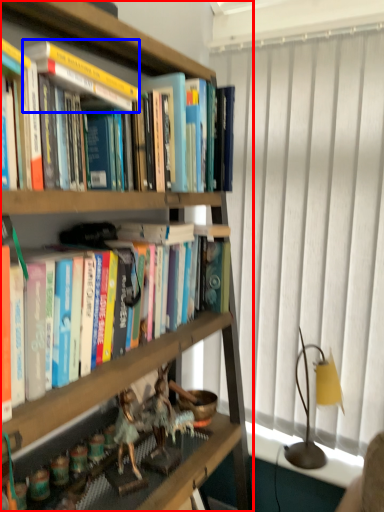
Question: Which point is closer to the camera, bookcase (highlighted by a red box) or paperback book (highlighted by a blue box)?

Choices:
 (A) bookcase
 (B) paperback book

Answer: (A)